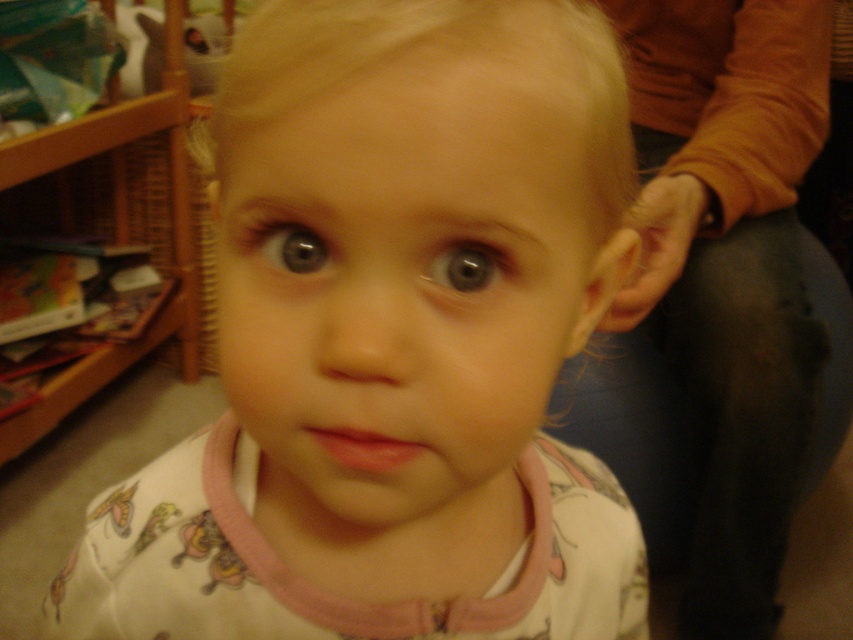
Question: Is white cotton shirt at center wider than soft pink pajamas at center?

Choices:
 (A) yes
 (B) no

Answer: (B)

Question: Which of the following is the farthest from the observer?

Choices:
 (A) white cotton shirt at center
 (B) smooth skin face at center
 (C) wooden bookshelf at left

Answer: (C)

Question: Which point is closer to the camera taking this photo?

Choices:
 (A) (33, 182)
 (B) (230, 362)

Answer: (B)

Question: Is white cotton shirt at center below soft pink pajamas at center?

Choices:
 (A) no
 (B) yes

Answer: (B)

Question: Which point is closer to the camera?

Choices:
 (A) (170, 140)
 (B) (654, 273)

Answer: (B)

Question: From the image, what is the correct spatial relationship of white cotton shirt at center in relation to soft pink pajamas at center?

Choices:
 (A) right
 (B) left

Answer: (B)